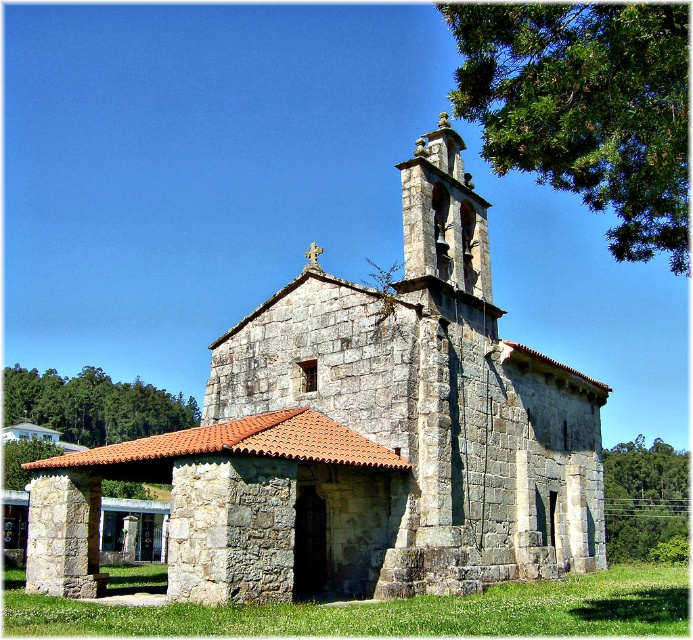
Question: Can you confirm if gray stone church at center is positioned above green leafy tree at upper left?

Choices:
 (A) no
 (B) yes

Answer: (B)

Question: Which of the following is the farthest from the observer?

Choices:
 (A) green leafy tree at upper right
 (B) green leafy tree at upper left

Answer: (B)

Question: Can you confirm if gray stone church at center is positioned to the right of green leafy tree at upper right?

Choices:
 (A) no
 (B) yes

Answer: (A)

Question: Which object is positioned closest to the green leafy tree at upper right?

Choices:
 (A) green leafy tree at right
 (B) gray stone church at center
 (C) green leafy tree at upper left

Answer: (B)

Question: Does gray stone church at center have a smaller size compared to green leafy tree at upper left?

Choices:
 (A) yes
 (B) no

Answer: (B)

Question: Which object appears closest to the camera in this image?

Choices:
 (A) green leafy tree at right
 (B) gray stone church at center

Answer: (B)